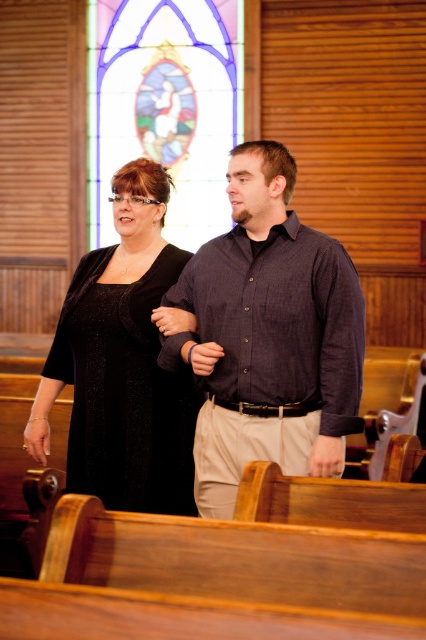
Is dark blue shirt at center behind stained glass window at upper center?

No, dark blue shirt at center is closer to the viewer.

Where is `dark blue shirt at center`? Image resolution: width=426 pixels, height=640 pixels. dark blue shirt at center is located at coordinates (268, 337).

Where is `dark blue shirt at center`? This screenshot has width=426, height=640. dark blue shirt at center is located at coordinates click(x=268, y=337).

Does dark blue shirt at center have a lesser width compared to black sparkly dress at center?

Yes.

Describe the element at coordinates (268, 337) in the screenshot. I see `dark blue shirt at center` at that location.

This screenshot has height=640, width=426. I want to click on dark blue shirt at center, so click(x=268, y=337).

From the picture: Is stained glass window at upper center wider than black sparkly dress at center?

Yes, stained glass window at upper center is wider than black sparkly dress at center.

Can you confirm if stained glass window at upper center is thinner than black sparkly dress at center?

In fact, stained glass window at upper center might be wider than black sparkly dress at center.

Locate an element on the screen. stained glass window at upper center is located at coordinates (164, 106).

Image resolution: width=426 pixels, height=640 pixels. Find the location of `stained glass window at upper center`. stained glass window at upper center is located at coordinates (164, 106).